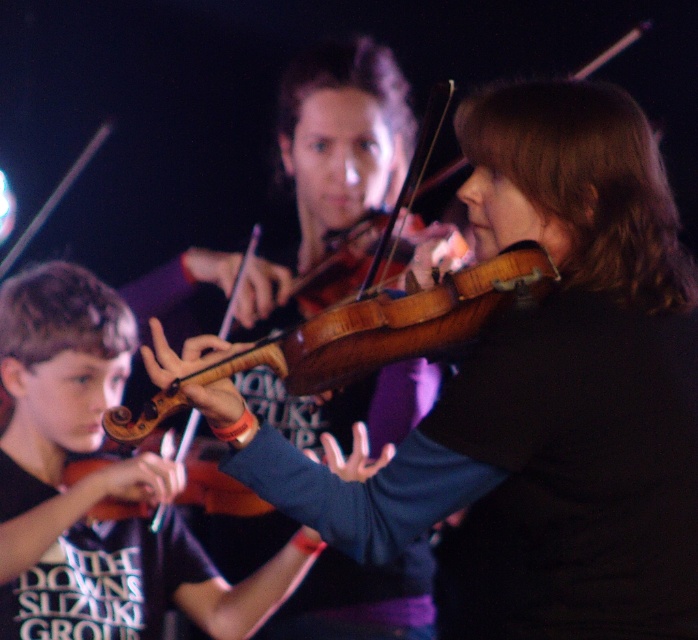
Is wooden violin at center above matte brown violin at lower left?

Yes, wooden violin at center is above matte brown violin at lower left.

Does wooden violin at center lie behind matte brown violin at lower left?

No, it is in front of matte brown violin at lower left.

Where is `wooden violin at center`? This screenshot has width=698, height=640. wooden violin at center is located at coordinates (542, 396).